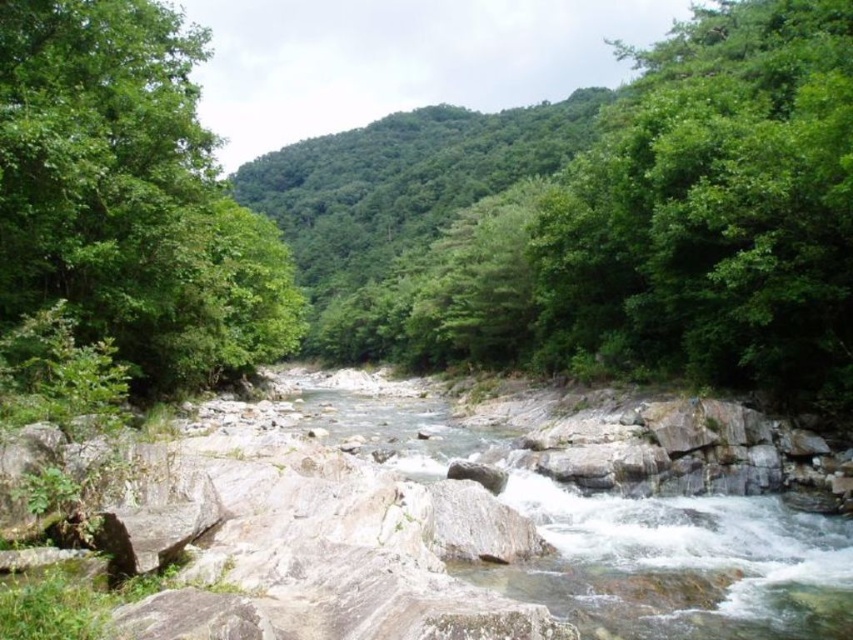
Question: Which object is the closest to the clear water at center?

Choices:
 (A) green leafy tree at left
 (B) green leafy tree at upper right

Answer: (A)

Question: Does green leafy tree at upper right appear on the right side of clear water at center?

Choices:
 (A) no
 (B) yes

Answer: (B)

Question: Observing the image, what is the correct spatial positioning of green leafy tree at upper right in reference to clear water at center?

Choices:
 (A) below
 (B) above

Answer: (B)

Question: Which of the following is the farthest from the observer?

Choices:
 (A) tap(846, 401)
 (B) tap(665, 604)

Answer: (A)

Question: Which object is closer to the camera taking this photo?

Choices:
 (A) green leafy tree at upper right
 (B) clear water at center
 (C) green leafy tree at left

Answer: (B)

Question: Is green leafy tree at left to the right of clear water at center from the viewer's perspective?

Choices:
 (A) yes
 (B) no

Answer: (B)